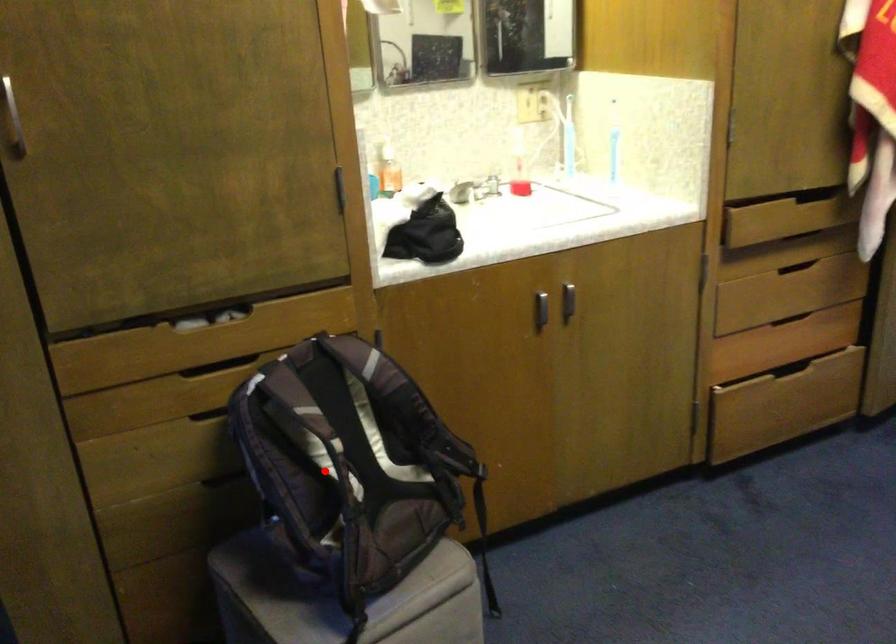
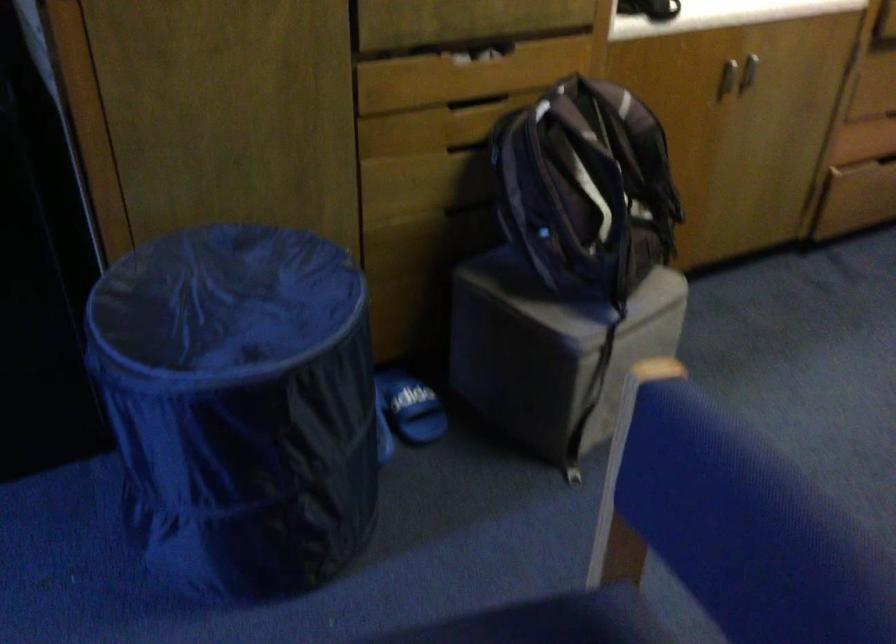
Find the pixel in the second image that matches the highlighted location in the first image.

(586, 187)